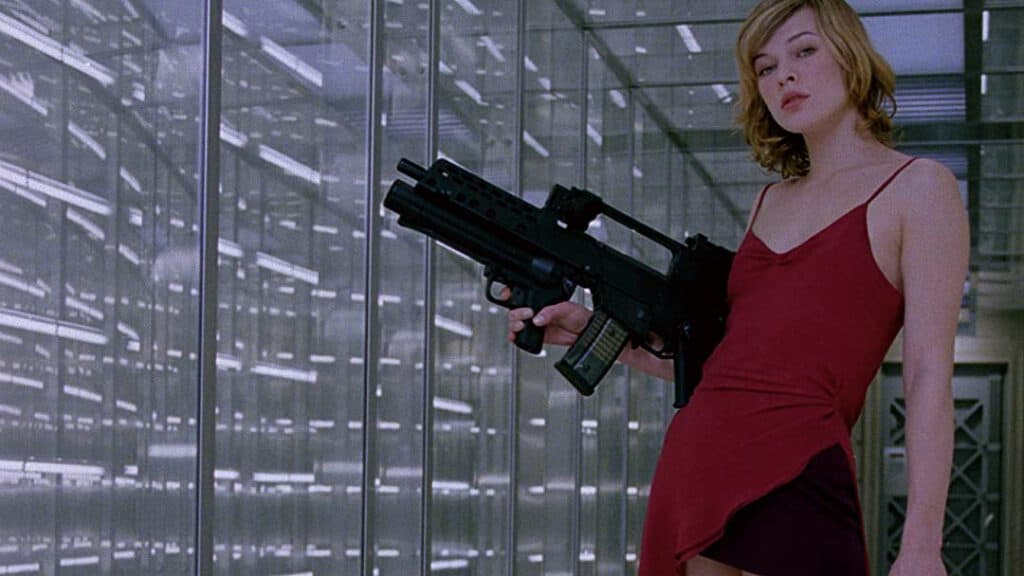
The width and height of the screenshot is (1024, 576). Identify the location of door. (959, 435).